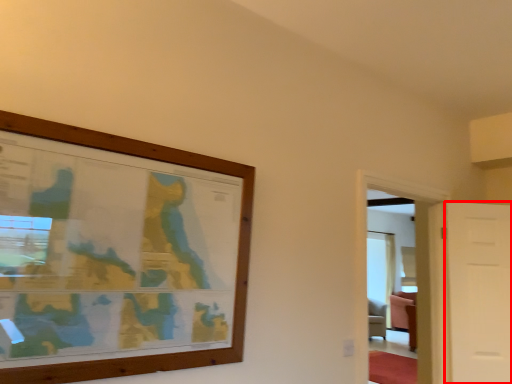
Question: From the image's perspective, where is door (annotated by the red box) located in relation to glass door in the image?

Choices:
 (A) above
 (B) below

Answer: (B)